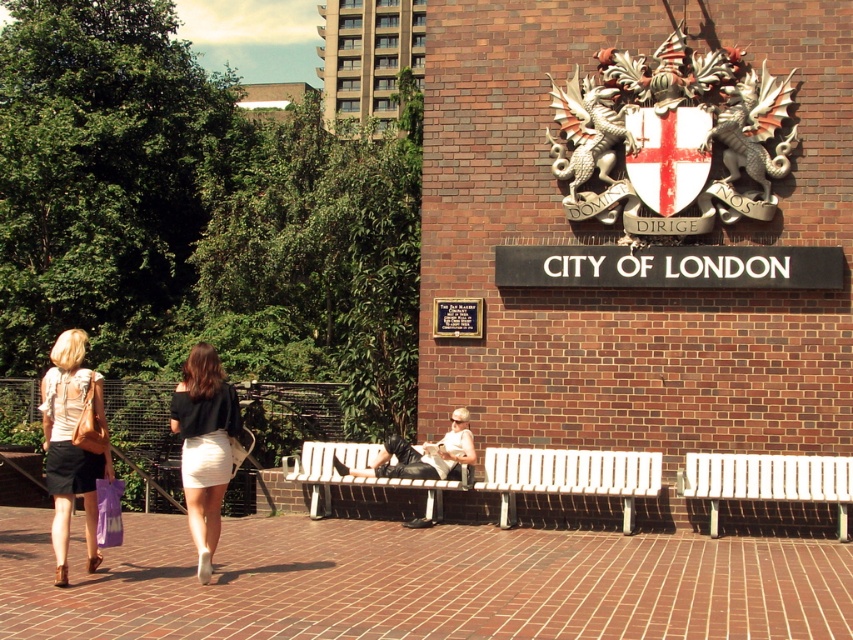
You are a tourist standing in front of the brick wall with the emblem and signage. You notice two items at the lower left corner of the scene. Which item is closer to you, the white textured skirt at lower left or the purple fabric shopping bag at lower left?

The white textured skirt at lower left is closer to you because it is in front of the purple fabric shopping bag at lower left.

You are a visitor to the City of London and want to sit on a bench. You see both the white wooden bench at center and the white plastic bench at center. Which one is above the other?

The white wooden bench at center is positioned under the white plastic bench at center, so the white plastic bench at center is above the white wooden bench at center.

Consider the image. You are a city planner evaluating the seating options in the plaza. There are two benches at the center of the plaza, a white wooden bench at center and a white plastic bench at center. Which bench can accommodate more people sitting side by side?

The white plastic bench at center can accommodate more people sitting side by side since its width is greater than the white wooden bench at center.